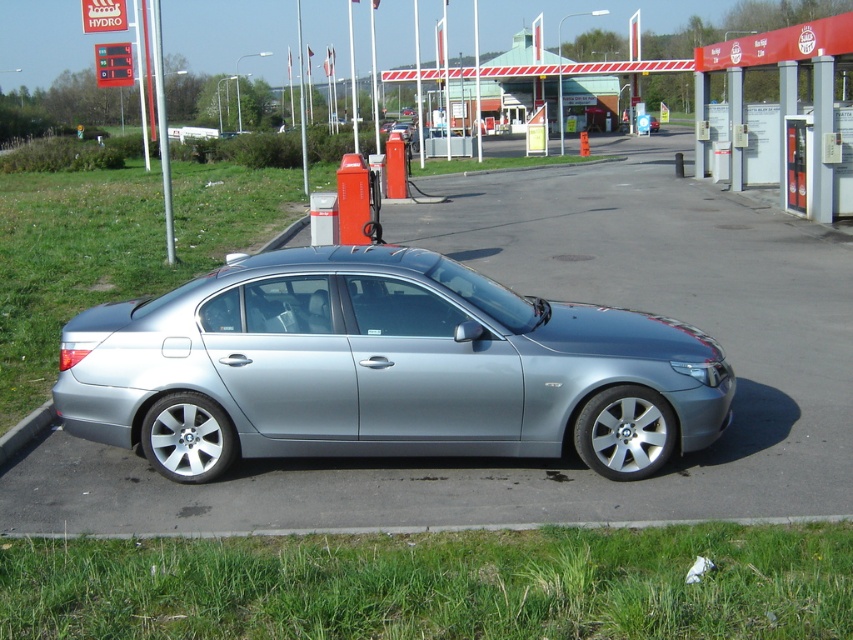
Looking at this image, between satin silver car at center and silver metallic pole at upper center, which one is positioned higher?

silver metallic pole at upper center

Does point (328, 454) lie in front of point (157, 36)?

Yes, it is.

I want to click on satin silver car at center, so click(383, 369).

Is satin silver car at center positioned in front of gray concrete curb at lower left?

That is True.

Who is more distant from viewer, (x=357, y=420) or (x=4, y=445)?

The point (x=4, y=445) is more distant.

Between point (309, 316) and point (12, 426), which one is positioned in front?

Point (309, 316) is in front.

At what (x,y) coordinates should I click in order to perform the action: click on satin silver car at center. Please return your answer as a coordinate pair (x, y). Image resolution: width=853 pixels, height=640 pixels. Looking at the image, I should click on (383, 369).

Who is more distant from viewer, (479, 76) or (160, 112)?

The point (479, 76) is more distant.

Can you confirm if red and white striped barrier gate at center is shorter than silver metallic pole at upper center?

Yes, red and white striped barrier gate at center is shorter than silver metallic pole at upper center.

The width and height of the screenshot is (853, 640). What do you see at coordinates (538, 68) in the screenshot? I see `red and white striped barrier gate at center` at bounding box center [538, 68].

You are a GUI agent. You are given a task and a screenshot of the screen. Output one action in this format:
    pyautogui.click(x=<x>, y=<y>)
    Task: Click on the red and white striped barrier gate at center
    The height and width of the screenshot is (640, 853).
    Given the screenshot: What is the action you would take?
    pyautogui.click(x=538, y=68)